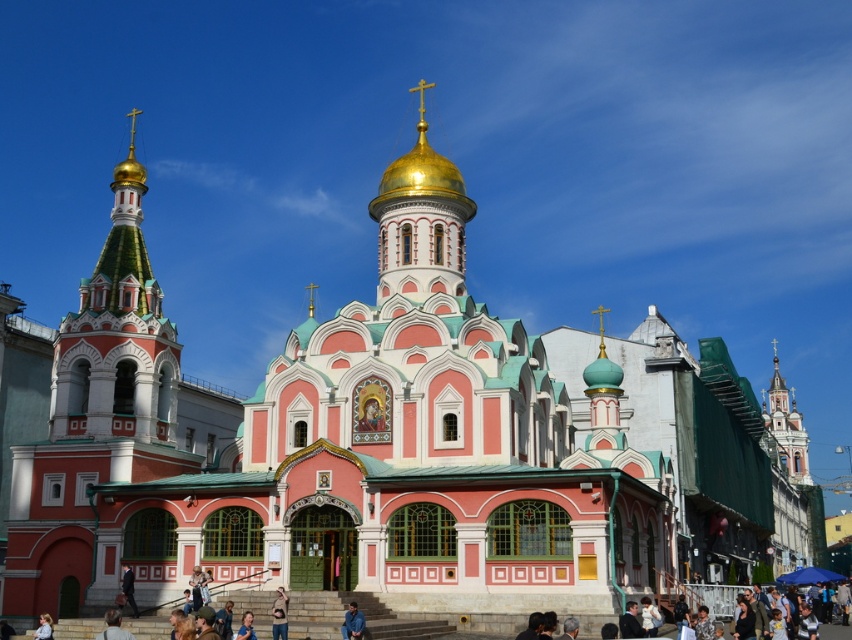
Question: Considering the relative positions of brown fabric shirt at lower center and light blue shirt at lower left in the image provided, where is brown fabric shirt at lower center located with respect to light blue shirt at lower left?

Choices:
 (A) right
 (B) left

Answer: (A)

Question: Is brown fabric shirt at lower center to the right of blue denim jeans at lower center from the viewer's perspective?

Choices:
 (A) yes
 (B) no

Answer: (B)

Question: Estimate the real-world distances between objects in this image. Which object is closer to the brown fabric shirt at lower center?

Choices:
 (A) light blue shirt at lower left
 (B) light brown hair at lower center
 (C) blue denim jeans at lower center

Answer: (C)

Question: Which point appears farthest from the camera in this image?

Choices:
 (A) (107, 630)
 (B) (245, 612)
 (C) (137, 614)

Answer: (C)

Question: Is light brown hair at lower center to the right of light brown leather jacket at lower center from the viewer's perspective?

Choices:
 (A) yes
 (B) no

Answer: (B)

Question: Which point is closer to the camera?

Choices:
 (A) (360, 636)
 (B) (245, 634)

Answer: (B)